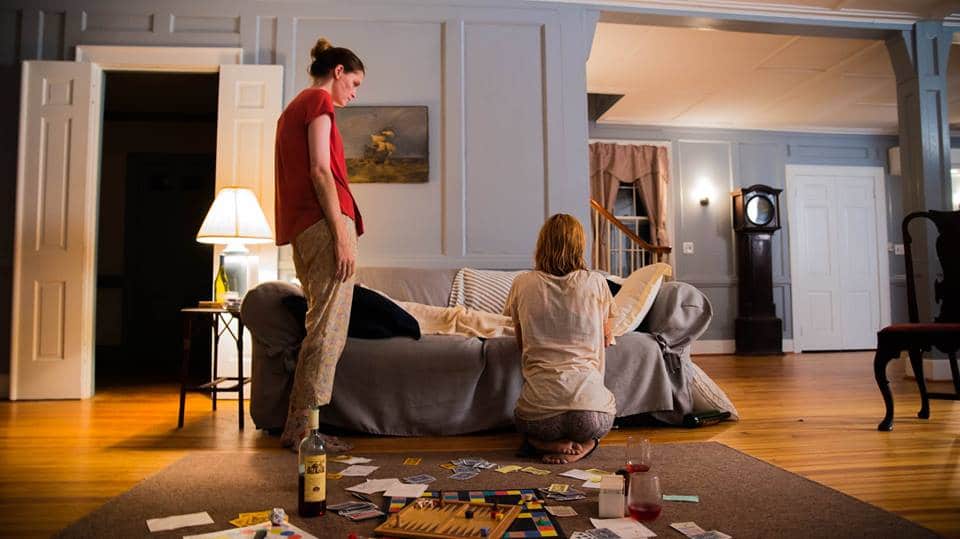
Locate an element on the screen. The height and width of the screenshot is (539, 960). wine glass is located at coordinates (648, 493), (643, 461).